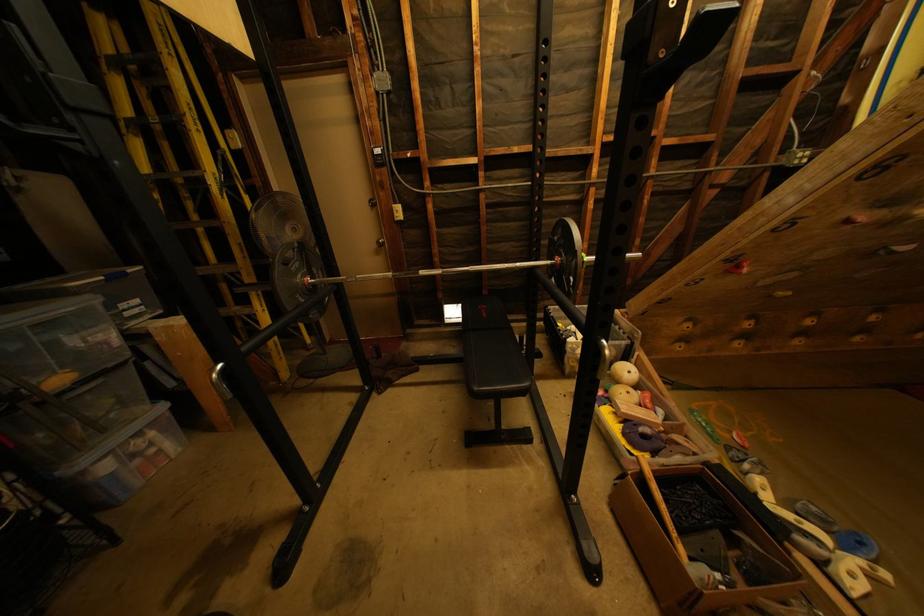
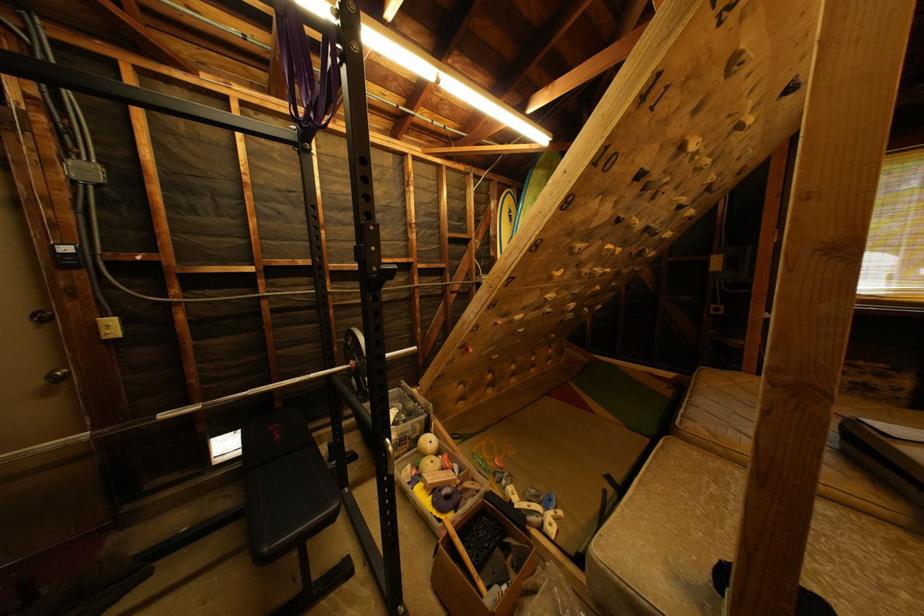
Question: The camera is either moving clockwise (left) or counter-clockwise (right) around the object. The first image is from the beginning of the video and the second image is from the end. Is the camera moving left or right when shooting the video?

Choices:
 (A) Left
 (B) Right

Answer: (A)